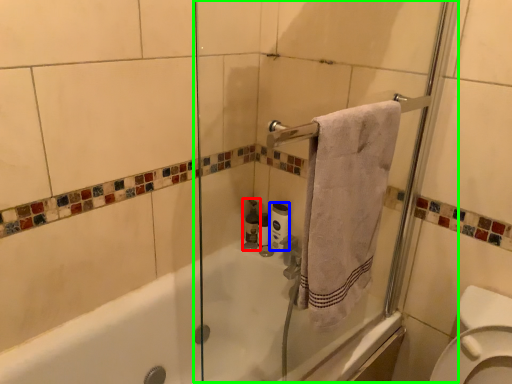
Question: Estimate the real-world distances between objects in this image. Which object is farther from toiletry (highlighted by a red box), toilet paper (highlighted by a blue box) or screen door (highlighted by a green box)?

Choices:
 (A) toilet paper
 (B) screen door

Answer: (A)